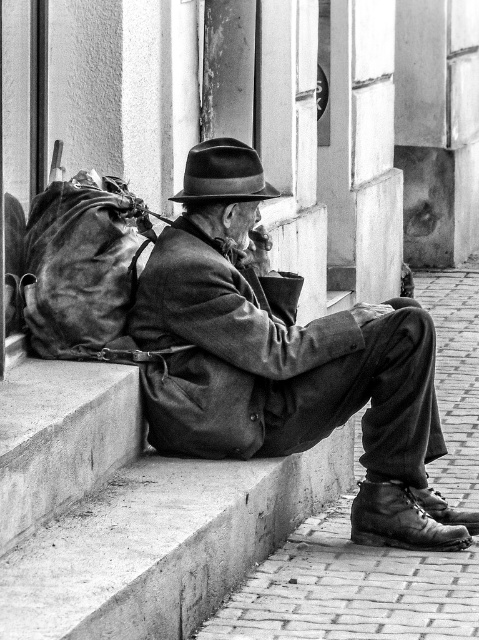
Question: Does concrete at lower left have a lesser width compared to leather backpack at left?

Choices:
 (A) no
 (B) yes

Answer: (A)

Question: Is leather backpack at left below felt fedora at center?

Choices:
 (A) yes
 (B) no

Answer: (A)

Question: Which point appears closest to the camera in this image?

Choices:
 (A) (167, 365)
 (B) (70, 579)

Answer: (B)

Question: Observing the image, what is the correct spatial positioning of concrete at lower left in reference to leather backpack at left?

Choices:
 (A) right
 (B) left

Answer: (A)

Question: Which object is positioned closest to the leather jacket at center?

Choices:
 (A) felt fedora at center
 (B) leather backpack at left
 (C) concrete at lower left

Answer: (B)

Question: Considering the real-world distances, which object is farthest from the leather jacket at center?

Choices:
 (A) felt fedora at center
 (B) leather backpack at left
 (C) concrete at lower left

Answer: (C)